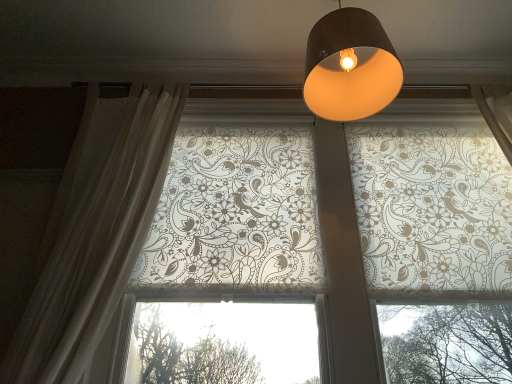
Question: In the image, is sheer white curtain at left on the left side or the right side of translucent floral-patterned roller blinds at upper center?

Choices:
 (A) right
 (B) left

Answer: (B)

Question: Considering the positions of sheer white curtain at left and translucent floral-patterned roller blinds at upper center in the image, is sheer white curtain at left wider or thinner than translucent floral-patterned roller blinds at upper center?

Choices:
 (A) thin
 (B) wide

Answer: (A)

Question: Which object is positioned closest to the translucent floral-patterned roller blinds at upper center?

Choices:
 (A) matte black lampshade at upper center
 (B) sheer white curtain at left

Answer: (B)

Question: Considering the real-world distances, which object is closest to the sheer white curtain at left?

Choices:
 (A) translucent floral-patterned roller blinds at upper center
 (B) matte black lampshade at upper center

Answer: (A)